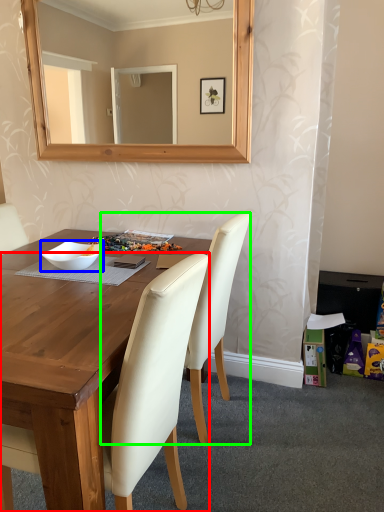
Question: Based on their relative distances, which object is nearer to chair (highlighted by a red box)? Choose from bowl (highlighted by a blue box) and chair (highlighted by a green box).

Choices:
 (A) bowl
 (B) chair

Answer: (B)